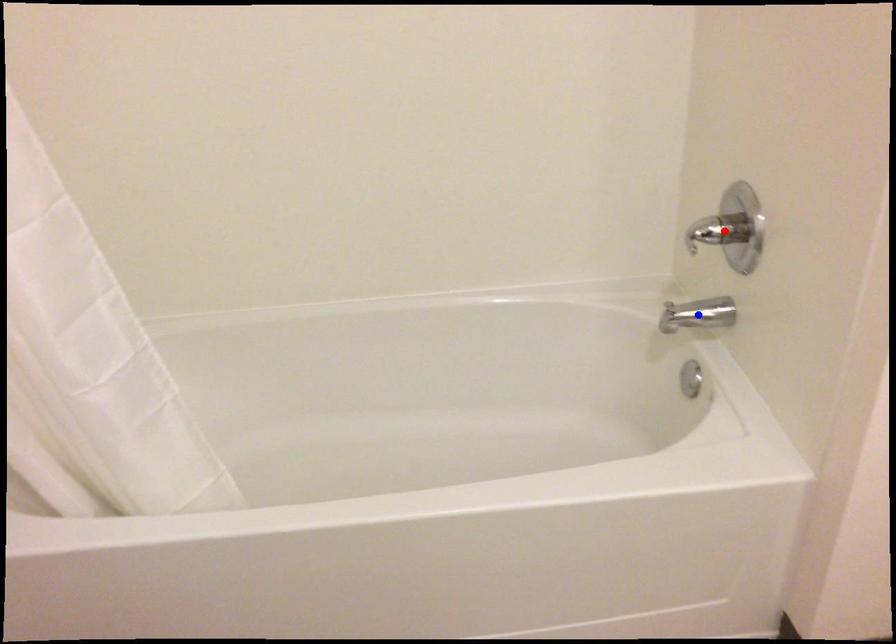
Question: Two points are marked on the image. Which point is closer to the camera?

Choices:
 (A) Blue point is closer.
 (B) Red point is closer.

Answer: (B)